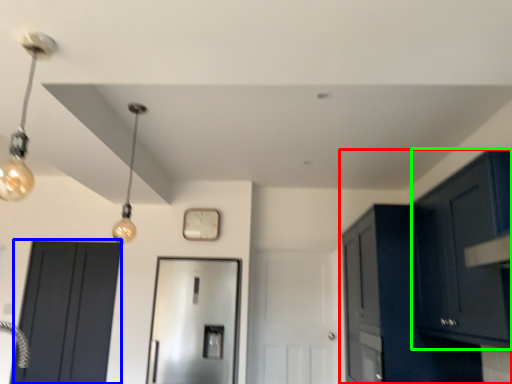
Question: Based on their relative distances, which object is nearer to cabinetry (highlighted by a red box)? Choose from door (highlighted by a blue box) and cabinetry (highlighted by a green box).

Choices:
 (A) door
 (B) cabinetry

Answer: (B)